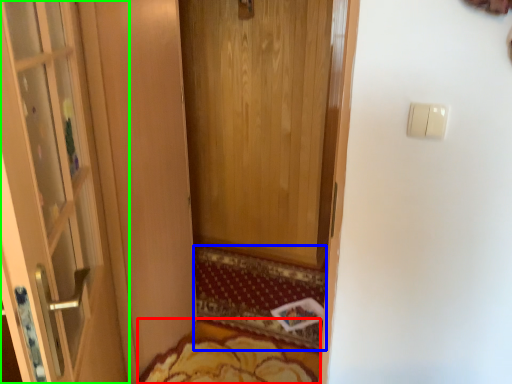
Question: Based on their relative distances, which object is farther from mat (highlighted by a red box)? Choose from doormat (highlighted by a blue box) and door (highlighted by a green box).

Choices:
 (A) doormat
 (B) door

Answer: (B)